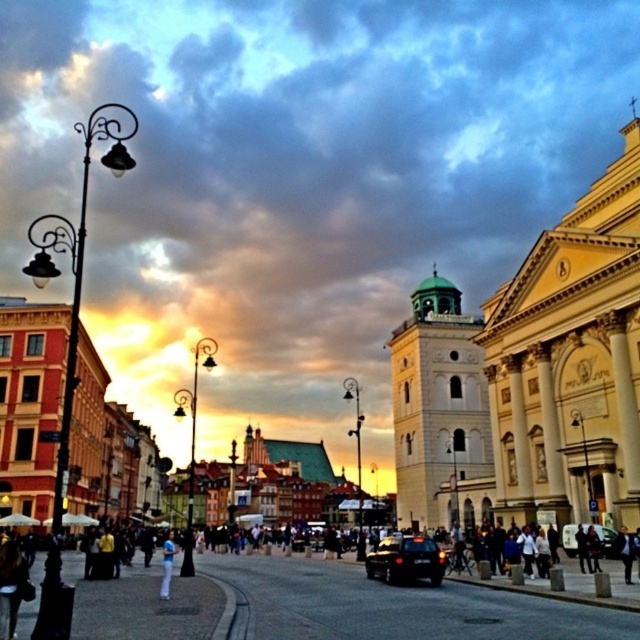
Question: Among these objects, which one is nearest to the camera?

Choices:
 (A) black matte car at lower center
 (B) shiny black car at center

Answer: (A)

Question: Does black matte car at lower center have a larger size compared to white cotton pants at lower center?

Choices:
 (A) no
 (B) yes

Answer: (A)

Question: Is black matte car at lower center further to the viewer compared to shiny black car at center?

Choices:
 (A) no
 (B) yes

Answer: (A)

Question: Is shiny black car at center below white cotton pants at lower center?

Choices:
 (A) no
 (B) yes

Answer: (A)

Question: Which of the following is the farthest from the observer?

Choices:
 (A) shiny black car at center
 (B) black matte car at lower center
 (C) white cotton pants at lower center

Answer: (A)

Question: Which object appears farthest from the camera in this image?

Choices:
 (A) shiny black car at center
 (B) black matte car at lower center
 (C) white cotton pants at lower center

Answer: (A)